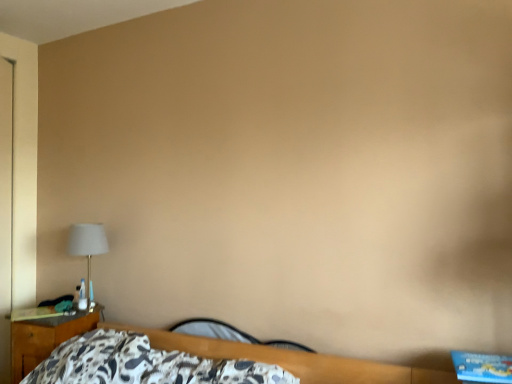
Question: From a real-world perspective, is wooden nightstand at left on top of matte white lampshade at left?

Choices:
 (A) yes
 (B) no

Answer: (B)

Question: Is wooden nightstand at left outside of matte white lampshade at left?

Choices:
 (A) yes
 (B) no

Answer: (A)

Question: From the image's perspective, is wooden nightstand at left over matte white lampshade at left?

Choices:
 (A) no
 (B) yes

Answer: (A)

Question: Is wooden nightstand at left facing towards matte white lampshade at left?

Choices:
 (A) yes
 (B) no

Answer: (B)

Question: Does wooden nightstand at left appear on the left side of matte white lampshade at left?

Choices:
 (A) no
 (B) yes

Answer: (B)

Question: Considering the positions of black leather guitar at lower center and matte white lampshade at left in the image, is black leather guitar at lower center taller or shorter than matte white lampshade at left?

Choices:
 (A) short
 (B) tall

Answer: (A)

Question: Is black leather guitar at lower center to the left or to the right of matte white lampshade at left in the image?

Choices:
 (A) left
 (B) right

Answer: (B)

Question: From a real-world perspective, is black leather guitar at lower center above or below matte white lampshade at left?

Choices:
 (A) above
 (B) below

Answer: (B)

Question: Is black leather guitar at lower center inside the boundaries of matte white lampshade at left, or outside?

Choices:
 (A) outside
 (B) inside

Answer: (A)

Question: Would you say black leather guitar at lower center is to the left or to the right of wooden nightstand at left in the picture?

Choices:
 (A) left
 (B) right

Answer: (B)

Question: Is black leather guitar at lower center bigger or smaller than wooden nightstand at left?

Choices:
 (A) big
 (B) small

Answer: (B)

Question: Is point (192, 319) positioned closer to the camera than point (92, 327)?

Choices:
 (A) closer
 (B) farther

Answer: (A)

Question: From the image's perspective, is black leather guitar at lower center located above or below wooden nightstand at left?

Choices:
 (A) below
 (B) above

Answer: (B)

Question: From their relative heights in the image, would you say matte white lampshade at left is taller or shorter than black leather guitar at lower center?

Choices:
 (A) tall
 (B) short

Answer: (A)

Question: In the image, is matte white lampshade at left positioned in front of or behind black leather guitar at lower center?

Choices:
 (A) front
 (B) behind

Answer: (B)